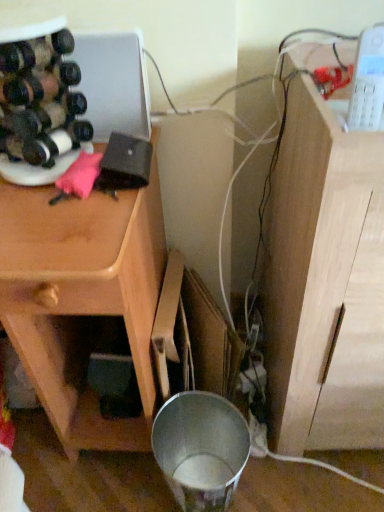
Question: From the image's perspective, relative to light wood cabinet at right, is wooden cabinet at left above or below?

Choices:
 (A) above
 (B) below

Answer: (B)

Question: Looking at their shapes, would you say wooden cabinet at left is wider or thinner than light wood cabinet at right?

Choices:
 (A) wide
 (B) thin

Answer: (B)

Question: Considering the real-world distances, which object is closest to the light wood cabinet at right?

Choices:
 (A) matte black wine bottle at left, positioned as the 1th wine bottle in bottom-to-top order
 (B) wooden cabinet at left
 (C) matte black wine bottle at left, the 2th wine bottle in the bottom-to-top sequence

Answer: (B)

Question: Based on their relative distances, which object is farther from the wooden cabinet at left?

Choices:
 (A) light wood cabinet at right
 (B) matte black wine bottle at left, the 2th wine bottle in the bottom-to-top sequence
 (C) matte black wine bottle at left, the second wine bottle when ordered from top to bottom

Answer: (A)